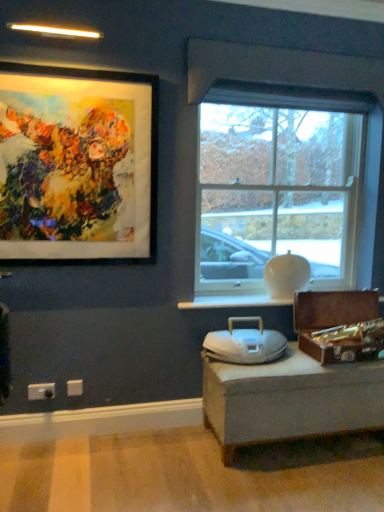
Question: Does clear glass window at center come in front of white glossy window sill at center?

Choices:
 (A) no
 (B) yes

Answer: (A)

Question: Considering the relative sizes of clear glass window at center and white glossy window sill at center in the image provided, is clear glass window at center smaller than white glossy window sill at center?

Choices:
 (A) no
 (B) yes

Answer: (A)

Question: Could you tell me if clear glass window at center is facing white glossy window sill at center?

Choices:
 (A) no
 (B) yes

Answer: (B)

Question: From a real-world perspective, is clear glass window at center positioned under white glossy window sill at center based on gravity?

Choices:
 (A) no
 (B) yes

Answer: (A)

Question: Can you confirm if clear glass window at center is wider than white glossy window sill at center?

Choices:
 (A) no
 (B) yes

Answer: (A)

Question: Is clear glass window at center at the left side of white glossy window sill at center?

Choices:
 (A) yes
 (B) no

Answer: (A)

Question: From a real-world perspective, is white plastic electric outlet at lower left, positioned as the first electric outlet in back-to-front order, on top of white plastic electric outlet at lower left, arranged as the 1th electric outlet when viewed from the front?

Choices:
 (A) yes
 (B) no

Answer: (A)

Question: Does white plastic electric outlet at lower left, the second electric outlet in the front-to-back sequence, have a greater height compared to white plastic electric outlet at lower left, which ranks as the 2th electric outlet in right-to-left order?

Choices:
 (A) yes
 (B) no

Answer: (B)

Question: From the image's perspective, is white plastic electric outlet at lower left, positioned as the first electric outlet in back-to-front order, on top of white plastic electric outlet at lower left, which is the 1th electric outlet in left-to-right order?

Choices:
 (A) no
 (B) yes

Answer: (B)

Question: Does white plastic electric outlet at lower left, which is the 1th electric outlet from right to left, have a lesser height compared to white plastic electric outlet at lower left, the second electric outlet when ordered from back to front?

Choices:
 (A) yes
 (B) no

Answer: (A)

Question: Is white plastic electric outlet at lower left, the second electric outlet when ordered from back to front, surrounded by white plastic electric outlet at lower left, which is the 1th electric outlet from right to left?

Choices:
 (A) yes
 (B) no

Answer: (B)

Question: From the image's perspective, is white plastic electric outlet at lower left, which is the 1th electric outlet from right to left, located beneath white plastic electric outlet at lower left, which is the 1th electric outlet in left-to-right order?

Choices:
 (A) yes
 (B) no

Answer: (B)

Question: Is matte black picture frame at upper left next to clear glass window at center?

Choices:
 (A) no
 (B) yes

Answer: (A)